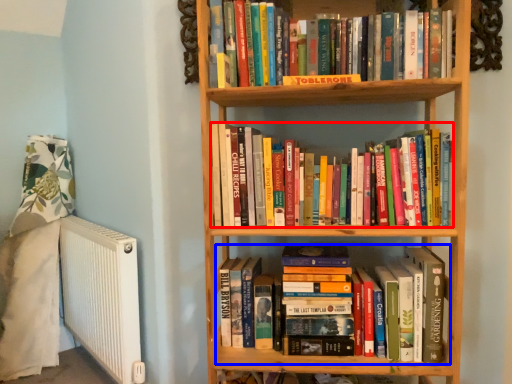
Question: Which object is further to the camera taking this photo, book (highlighted by a red box) or book (highlighted by a blue box)?

Choices:
 (A) book
 (B) book

Answer: (B)